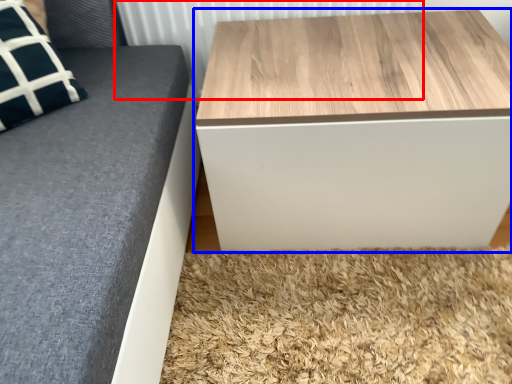
Question: Which object appears farthest to the camera in this image, radiator (highlighted by a red box) or table (highlighted by a blue box)?

Choices:
 (A) radiator
 (B) table

Answer: (A)